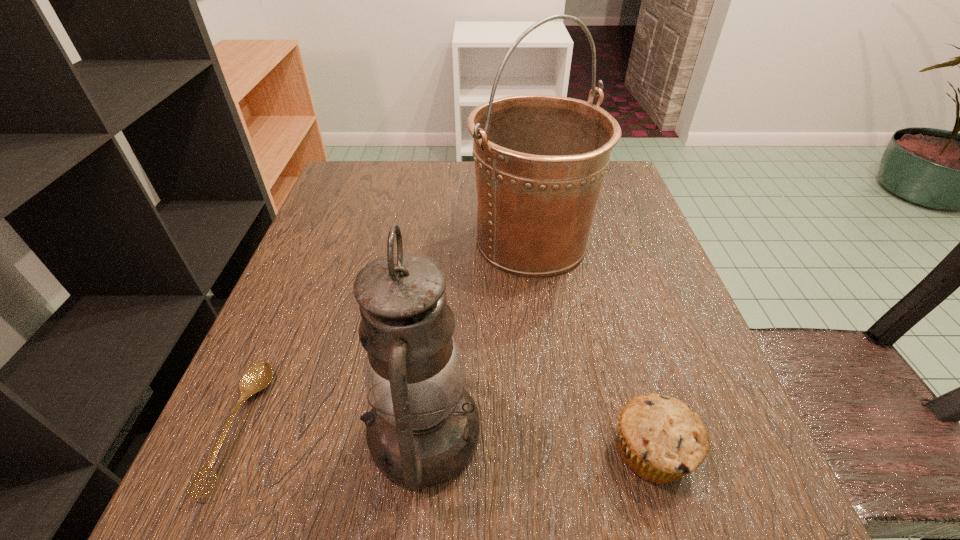
This screenshot has width=960, height=540. I want to click on vacant space at the far edge, so click(468, 180).

I want to click on free space at the near edge of the desktop, so click(x=526, y=512).

Locate an element on the screen. This screenshot has width=960, height=540. free space at the left edge is located at coordinates (295, 430).

In the image, there is a desktop. Where is `vacant area at the right edge`? Image resolution: width=960 pixels, height=540 pixels. vacant area at the right edge is located at coordinates (656, 388).

You are a GUI agent. You are given a task and a screenshot of the screen. Output one action in this format:
    pyautogui.click(x=<x>, y=<y>)
    Task: Click on the vacant region at the far left corner of the desktop
    
    Given the screenshot: What is the action you would take?
    pyautogui.click(x=401, y=171)

What are the coordinates of `vacant space at the near left corner of the desktop` in the screenshot? It's located at (245, 476).

In order to click on vacant space at the far right corner of the desktop in this screenshot , I will do `click(605, 176)`.

Locate an element on the screen. free area in between the tallest object and the third shortest object is located at coordinates (477, 338).

The image size is (960, 540). What are the coordinates of `vacant space in between the bucket and the third shortest object` in the screenshot? It's located at (477, 338).

Find the location of a particular element. The image size is (960, 540). blank region between the oil lamp and the third tallest object is located at coordinates (538, 443).